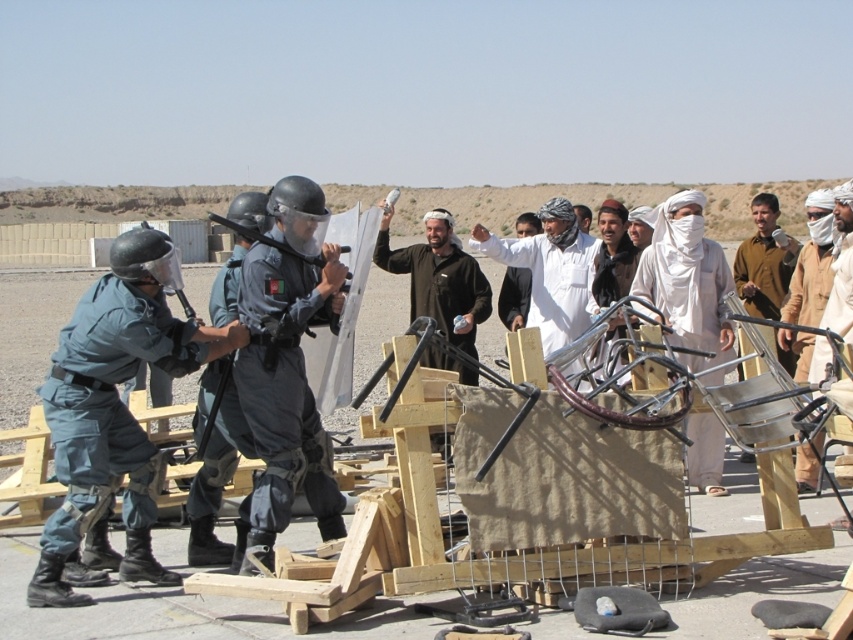
Question: Which object is closer to the camera taking this photo?

Choices:
 (A) brown fabric turban at center
 (B) white cotton turban at center
 (C) light brown fabric at center

Answer: (A)

Question: Considering the relative positions of light brown fabric at center and brown fabric turban at center in the image provided, where is light brown fabric at center located with respect to brown fabric turban at center?

Choices:
 (A) below
 (B) above

Answer: (B)

Question: Which object is closer to the camera taking this photo?

Choices:
 (A) light brown fabric at center
 (B) wooden frame at center
 (C) brown fabric turban at center
 (D) white cotton turban at center

Answer: (B)

Question: Which object appears closest to the camera in this image?

Choices:
 (A) brown fabric turban at center
 (B) wooden frame at center
 (C) light brown fabric at center

Answer: (B)

Question: Can you confirm if white cotton turban at center is positioned to the left of light brown fabric at center?

Choices:
 (A) yes
 (B) no

Answer: (B)

Question: Is light brown fabric at center below brown fabric turban at center?

Choices:
 (A) no
 (B) yes

Answer: (A)